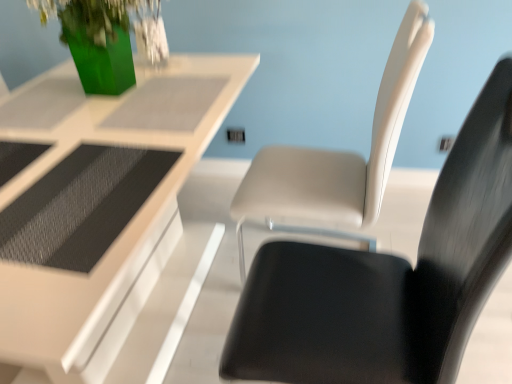
Where is `free spot above white glossy table at upper center (from a real-world perspective)`? Image resolution: width=512 pixels, height=384 pixels. free spot above white glossy table at upper center (from a real-world perspective) is located at coordinates click(x=108, y=117).